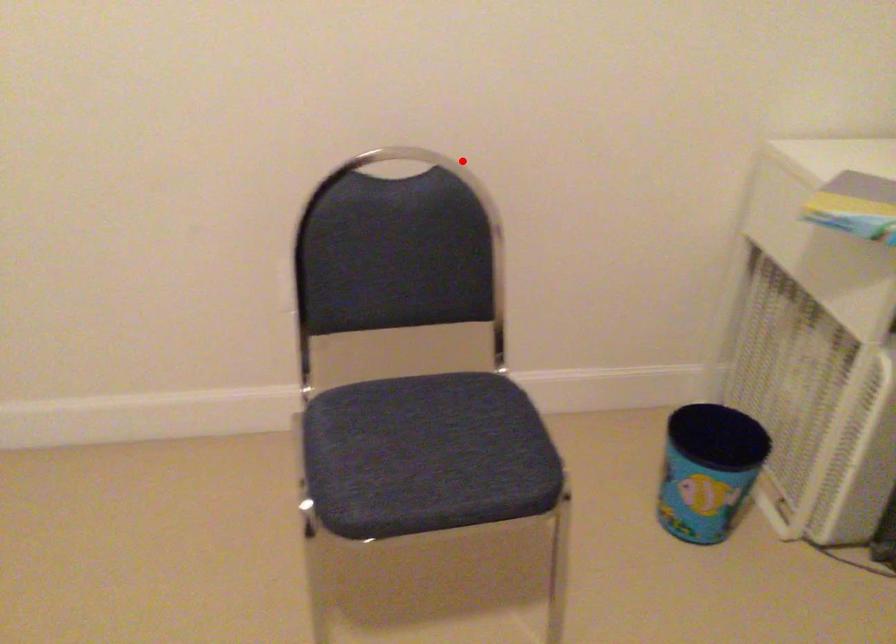
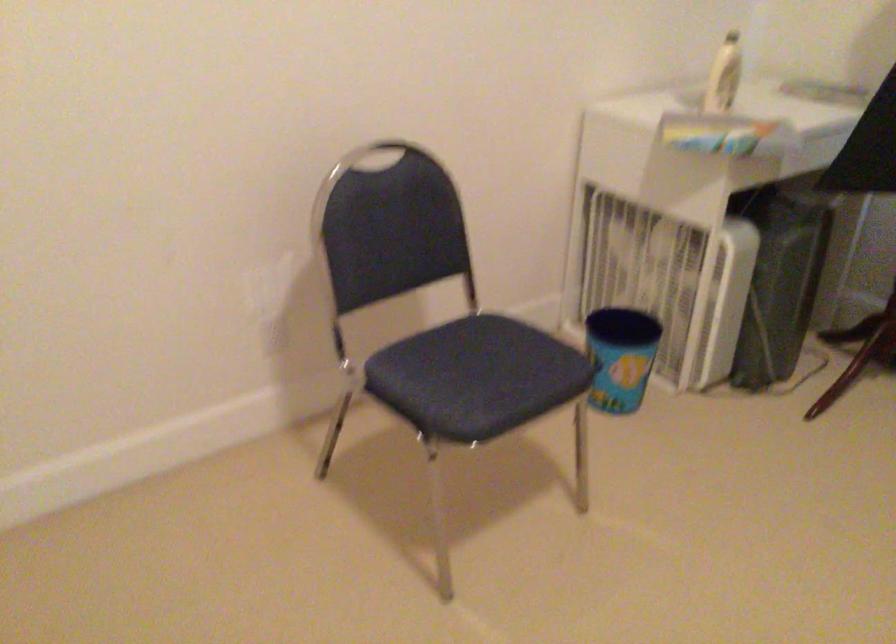
Question: I am providing you with two images of the same scene from different viewpoints. Given a red point in image1, look at the same physical point in image2. Is it:

Choices:
 (A) Closer to the viewpoint
 (B) Farther from the viewpoint

Answer: (B)